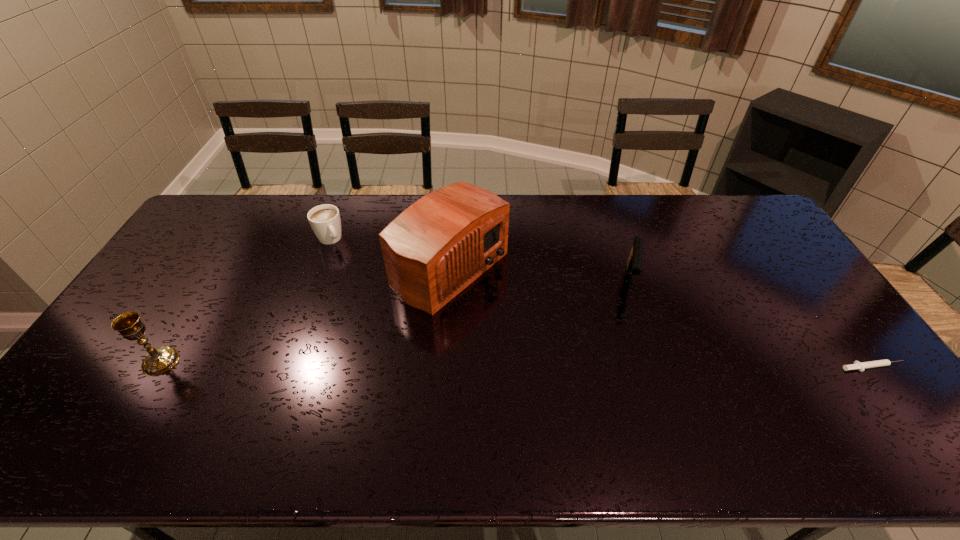
Find the location of `free space located 0.090m on the right of the leftmost object`. free space located 0.090m on the right of the leftmost object is located at coordinates 212,361.

What are the coordinates of `free spot located 0.340m on the back of the rightmost object` in the screenshot? It's located at (804, 273).

The width and height of the screenshot is (960, 540). In order to click on vacant space located 0.180m with the handle on the side of the cappuccino in this screenshot , I will do (x=356, y=280).

The height and width of the screenshot is (540, 960). I want to click on vacant space situated with the handle on the side of the cappuccino, so click(x=368, y=297).

Identify the location of blank area located 0.190m with the handle on the side of the cappuccino. (357, 281).

You are a GUI agent. You are given a task and a screenshot of the screen. Output one action in this format:
    pyautogui.click(x=<x>, y=<y>)
    Task: Click on the free space located at the barrel of the fourth object from left to right
    The image size is (960, 540).
    Given the screenshot: What is the action you would take?
    pyautogui.click(x=627, y=366)

At what (x,y) coordinates should I click in order to perform the action: click on free space located at the barrel of the fourth object from left to right. Please return your answer as a coordinate pair (x, y). Image resolution: width=960 pixels, height=540 pixels. Looking at the image, I should click on (631, 313).

Identify the location of vacant region located at the barrel of the fourth object from left to right. The image size is (960, 540). (627, 372).

Where is `free location located on the front-facing side of the radio receiver`? This screenshot has width=960, height=540. free location located on the front-facing side of the radio receiver is located at coordinates (508, 306).

This screenshot has height=540, width=960. In order to click on vacant area situated on the front-facing side of the radio receiver in this screenshot , I will do `click(508, 306)`.